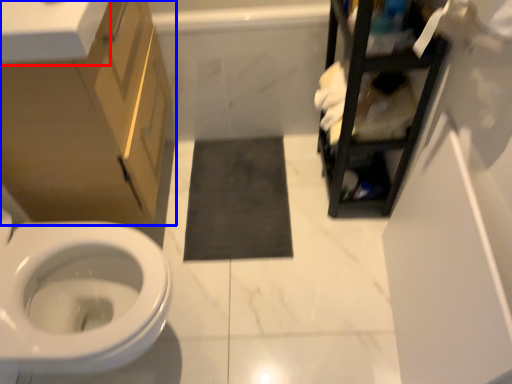
Question: Which object is further to the camera taking this photo, counter top (highlighted by a red box) or bathroom cabinet (highlighted by a blue box)?

Choices:
 (A) counter top
 (B) bathroom cabinet

Answer: (B)